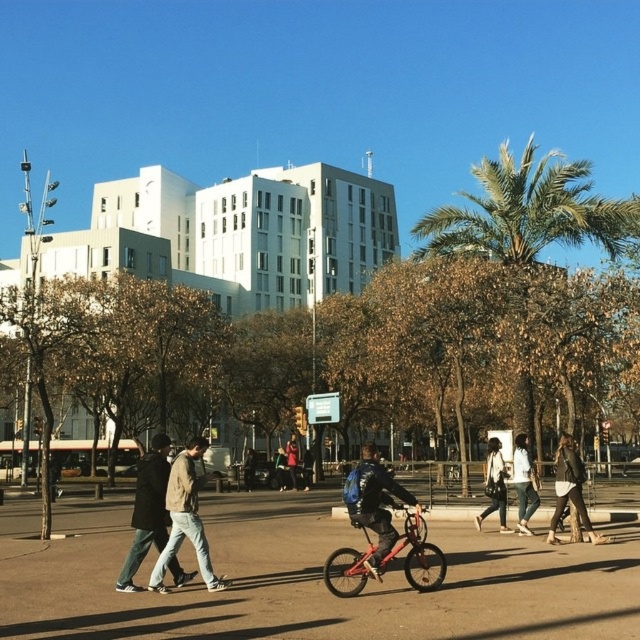
Between metallic red bicycle at center and denim jacket at center, which one is positioned lower?

denim jacket at center

Who is more forward, [440,554] or [502,486]?

Positioned in front is point [440,554].

The height and width of the screenshot is (640, 640). In order to click on metallic red bicycle at center in this screenshot , I will do `click(417, 554)`.

Is point (564, 216) less distant than point (244, 486)?

Yes.

Locate an element on the screen. green leafy palm tree at upper right is located at coordinates (528, 211).

You are a GUI agent. You are given a task and a screenshot of the screen. Output one action in this format:
    pyautogui.click(x=<x>, y=<y>)
    Task: Click on the green leafy palm tree at upper right
    
    Given the screenshot: What is the action you would take?
    pyautogui.click(x=528, y=211)

Is point (339, 586) farther from camera compared to point (172, 538)?

No, it is in front of (172, 538).

Which is in front, point (397, 540) or point (173, 497)?

Point (397, 540) is in front.

Locate an element on the screen. metallic red bicycle at center is located at coordinates (417, 554).